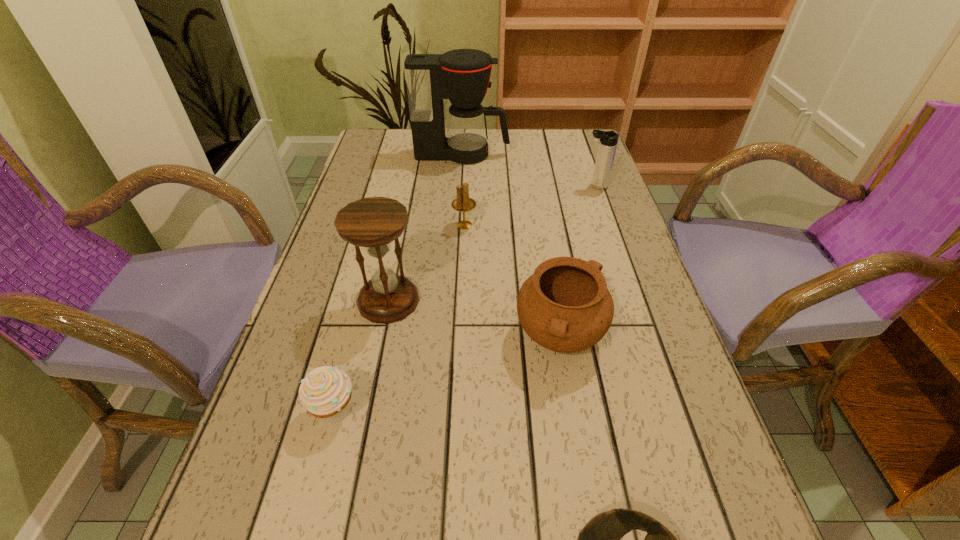
Identify the location of vacant point that satisfies the following two spatial constraints: 1. pour from the carafe of the farthest object; 2. on the right side of the candle holder. The height and width of the screenshot is (540, 960). (458, 225).